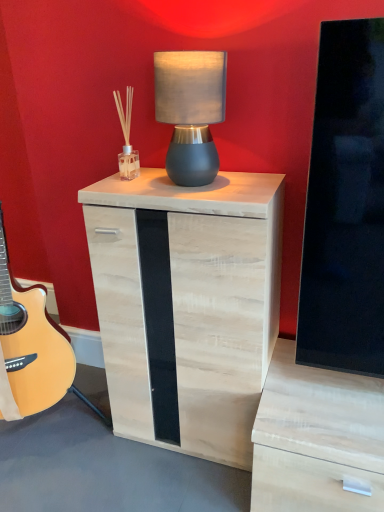
Question: Is natural wood nightstand at center to the right of matte gray lampshade at center from the viewer's perspective?

Choices:
 (A) yes
 (B) no

Answer: (B)

Question: From the image's perspective, is natural wood nightstand at center below matte gray lampshade at center?

Choices:
 (A) yes
 (B) no

Answer: (A)

Question: Is natural wood nightstand at center positioned beyond the bounds of matte gray lampshade at center?

Choices:
 (A) yes
 (B) no

Answer: (A)

Question: Is natural wood nightstand at center in contact with matte gray lampshade at center?

Choices:
 (A) yes
 (B) no

Answer: (B)

Question: From a real-world perspective, is natural wood nightstand at center positioned over matte gray lampshade at center based on gravity?

Choices:
 (A) yes
 (B) no

Answer: (B)

Question: Is the position of natural wood nightstand at center less distant than that of matte gray lampshade at center?

Choices:
 (A) no
 (B) yes

Answer: (A)

Question: Is the depth of matte gray lampshade at center greater than that of natural wood nightstand at center?

Choices:
 (A) no
 (B) yes

Answer: (A)

Question: Would you say natural wood nightstand at center is part of matte gray lampshade at center's contents?

Choices:
 (A) yes
 (B) no

Answer: (B)

Question: From the image's perspective, is matte gray lampshade at center located beneath natural wood nightstand at center?

Choices:
 (A) yes
 (B) no

Answer: (B)

Question: Is matte gray lampshade at center positioned with its back to natural wood nightstand at center?

Choices:
 (A) no
 (B) yes

Answer: (A)

Question: From a real-world perspective, is matte gray lampshade at center positioned under natural wood nightstand at center based on gravity?

Choices:
 (A) yes
 (B) no

Answer: (B)

Question: Is matte gray lampshade at center positioned far away from natural wood nightstand at center?

Choices:
 (A) no
 (B) yes

Answer: (A)

Question: From a real-world perspective, is matte gray lampshade at center physically located above or below natural wood nightstand at center?

Choices:
 (A) above
 (B) below

Answer: (A)